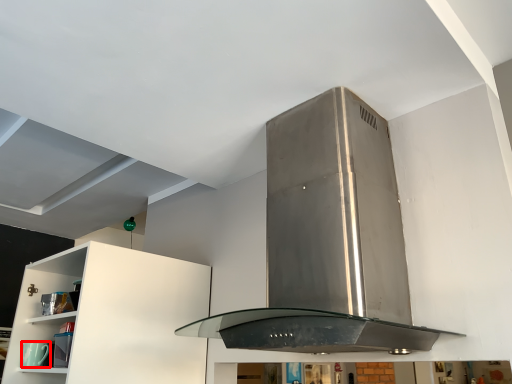
Question: From the image's perspective, where is appliance (annotated by the red box) located in relation to home appliance in the image?

Choices:
 (A) below
 (B) above

Answer: (A)